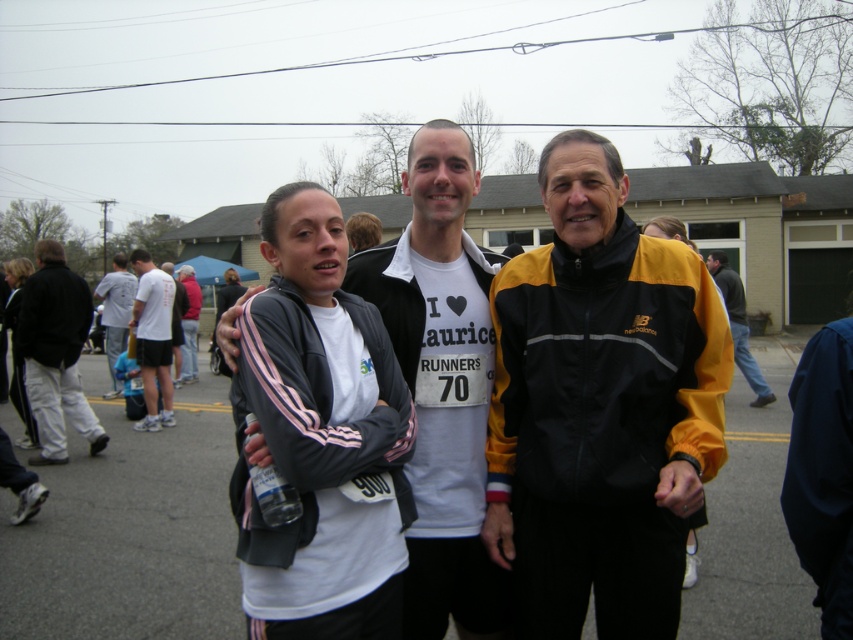
You are standing at the starting line of the race and see two points in the image, point (126, 273) and point (190, 316). Which point is nearer to you?

Point (126, 273) is closer to the viewer than point (190, 316), so the point (126, 273) is nearer to you.